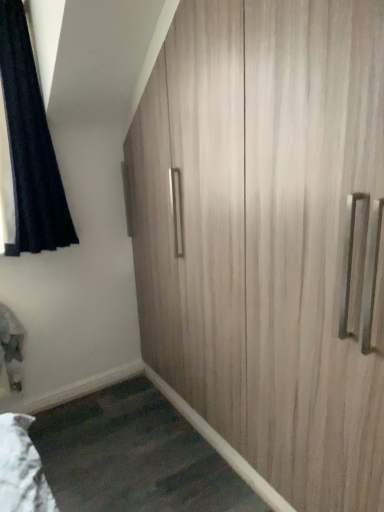
Question: Relative to light wood cupboard at center, is black velvet curtain at upper left in front or behind?

Choices:
 (A) behind
 (B) front

Answer: (A)

Question: Is black velvet curtain at upper left bigger or smaller than light wood cupboard at center?

Choices:
 (A) small
 (B) big

Answer: (A)

Question: Visually, is black velvet curtain at upper left positioned to the left or to the right of light wood cupboard at center?

Choices:
 (A) left
 (B) right

Answer: (A)

Question: From a real-world perspective, is light wood cupboard at center positioned above or below black velvet curtain at upper left?

Choices:
 (A) below
 (B) above

Answer: (A)

Question: Is point (246, 152) positioned closer to the camera than point (13, 198)?

Choices:
 (A) farther
 (B) closer

Answer: (B)

Question: From the image's perspective, relative to black velvet curtain at upper left, is light wood cupboard at center above or below?

Choices:
 (A) below
 (B) above

Answer: (A)

Question: Would you say light wood cupboard at center is inside or outside black velvet curtain at upper left?

Choices:
 (A) outside
 (B) inside

Answer: (A)